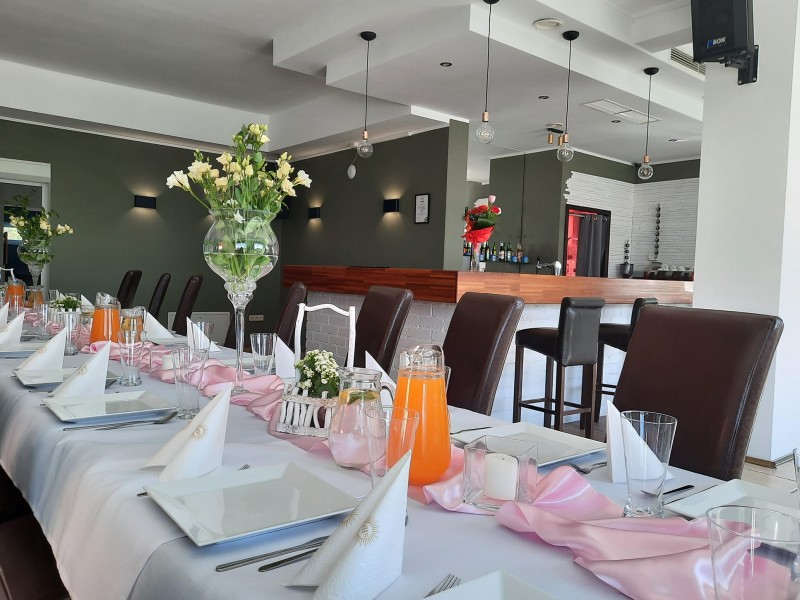
In order to click on square plates in this screenshot , I will do `click(238, 510)`, `click(134, 403)`, `click(50, 375)`, `click(21, 344)`, `click(20, 331)`, `click(222, 350)`, `click(528, 440)`, `click(697, 499)`.